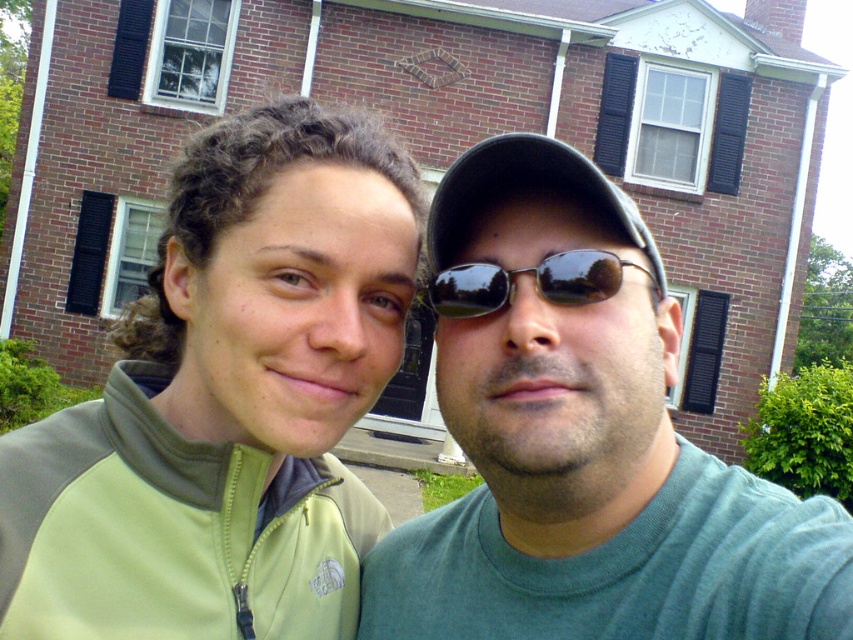
Who is higher up, black matte baseball cap at center or black reflective sunglasses at center?

Positioned higher is black matte baseball cap at center.

In the scene shown: Can you confirm if black matte baseball cap at center is positioned to the right of black reflective sunglasses at center?

Correct, you'll find black matte baseball cap at center to the right of black reflective sunglasses at center.

Between point (555, 164) and point (548, 269), which one is positioned in front?

Point (548, 269) is in front.

Where is `black matte baseball cap at center`? Image resolution: width=853 pixels, height=640 pixels. black matte baseball cap at center is located at coordinates (527, 195).

Does green fleece jacket at center appear on the left side of black matte baseball cap at center?

Correct, you'll find green fleece jacket at center to the left of black matte baseball cap at center.

Which is in front, point (294, 579) or point (500, 136)?

Point (500, 136)

Is point (367, 292) positioned behind point (454, 230)?

No.

Identify the location of green fleece jacket at center. Image resolution: width=853 pixels, height=640 pixels. (227, 401).

Is point (183, 461) more distant than point (781, 516)?

Yes, it is.

Does green fleece jacket at center lie in front of green matte shirt at center?

No, it is behind green matte shirt at center.

The width and height of the screenshot is (853, 640). Describe the element at coordinates (227, 401) in the screenshot. I see `green fleece jacket at center` at that location.

Image resolution: width=853 pixels, height=640 pixels. Identify the location of green fleece jacket at center. (227, 401).